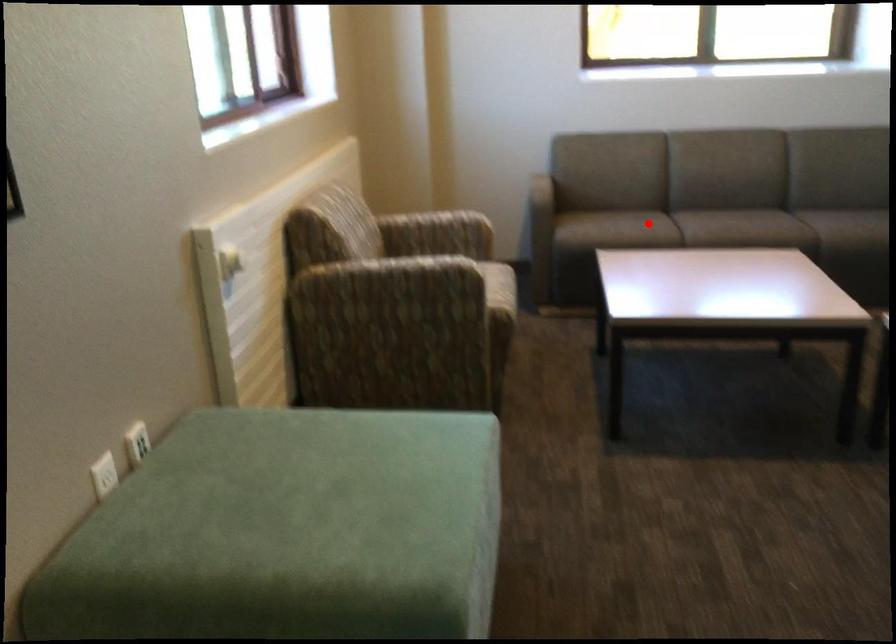
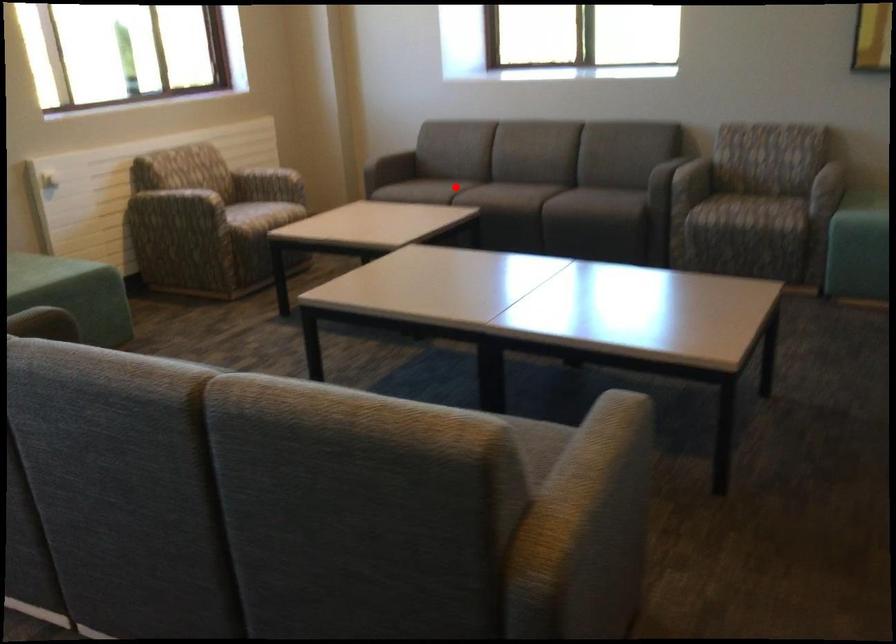
I am providing you with two images of the same scene from different viewpoints. A red point is marked on the first image and another point is marked on the second image. Is the red point in image1 aligned with the point shown in image2?

Yes